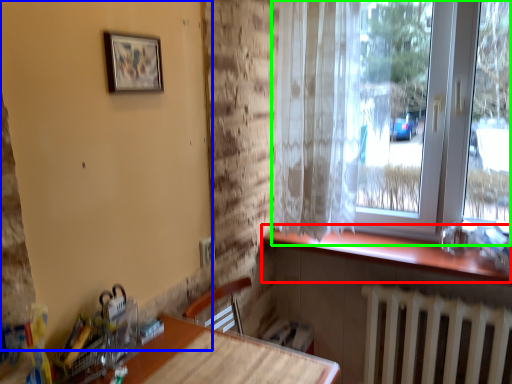
Question: Based on their relative distances, which object is nearer to window sill (highlighted by a red box)? Choose from backdrop (highlighted by a blue box) and window (highlighted by a green box).

Choices:
 (A) backdrop
 (B) window

Answer: (B)